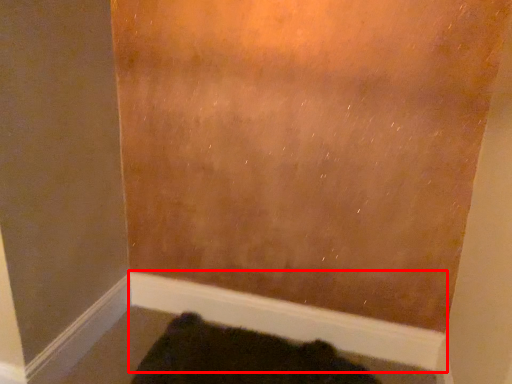
Question: Where is molding (annotated by the red box) located in relation to animal in the image?

Choices:
 (A) right
 (B) left

Answer: (A)